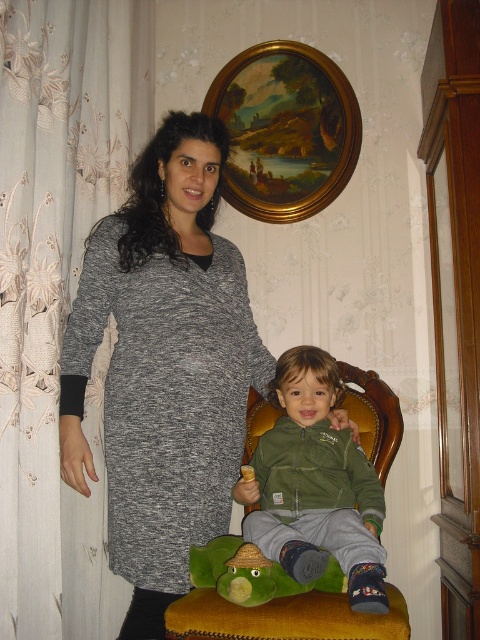
Based on the photo, does gray knit dress at left have a smaller size compared to oil painting at upper center?

No.

Between gray knit dress at left and oil painting at upper center, which one is positioned higher?

oil painting at upper center is above.

Locate an element on the screen. This screenshot has width=480, height=640. gray knit dress at left is located at coordinates pos(164,365).

Can you confirm if gray knit dress at left is positioned to the left of green plush toy at lower center?

Correct, you'll find gray knit dress at left to the left of green plush toy at lower center.

Does point (163, 435) come farther from viewer compared to point (265, 600)?

Yes, it is.

At what (x,y) coordinates should I click in order to perform the action: click on gray knit dress at left. Please return your answer as a coordinate pair (x, y). Looking at the image, I should click on point(164,365).

I want to click on gray knit dress at left, so click(x=164, y=365).

Which is in front, point (9, 602) or point (84, 355)?

Point (9, 602) is in front.

Is point (43, 269) closer to viewer compared to point (132, 356)?

Yes, point (43, 269) is in front of point (132, 356).

Where is `white lace curtain at left`? white lace curtain at left is located at coordinates click(58, 285).